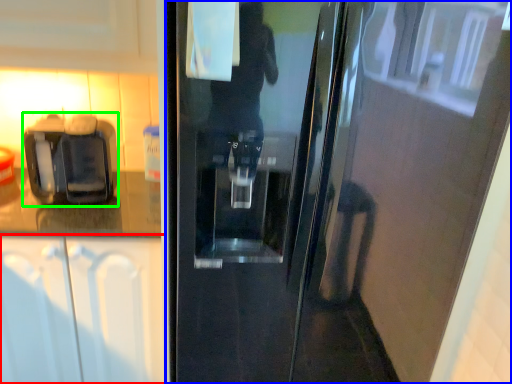
Question: Which object is positioned closest to cabinetry (highlighted by a red box)? Select from door (highlighted by a blue box) and coffee machine (highlighted by a green box).

Choices:
 (A) door
 (B) coffee machine

Answer: (B)